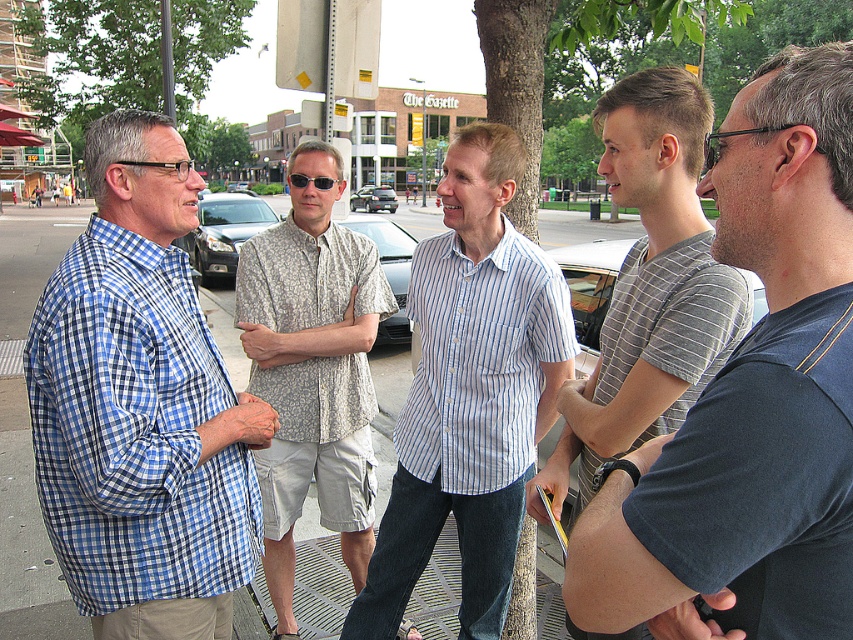
You are a photographer standing 1.5 meters away from the blue striped shirt at center. You want to take a photo of the camera which is behind the tree trunk. Can you adjust your position so that the camera is visible without moving the tree trunk or the camera? Explain your reasoning.

The blue striped shirt at center and camera are 2.43 meters apart. Since you are 1.5 meters away from the blue striped shirt at center, the total distance between you and the camera is 1.5 meters plus 2.43 meters, totaling 3.93 meters. However, the tree trunk is blocking the view. To see the camera without moving it or the tree, you would need to move around the tree trunk to a position where the line of sight between you and the camera is unobstructed. The exact path depends on the tree trunk and grate

You are standing at the camera position and want to pick up an object located at point (74, 260). Can you reach it without moving your feet?

The distance between you and the point (74, 260) is 1.97 meters. Since the average human arm length is about 0.7 meters, you cannot reach it without moving your feet.